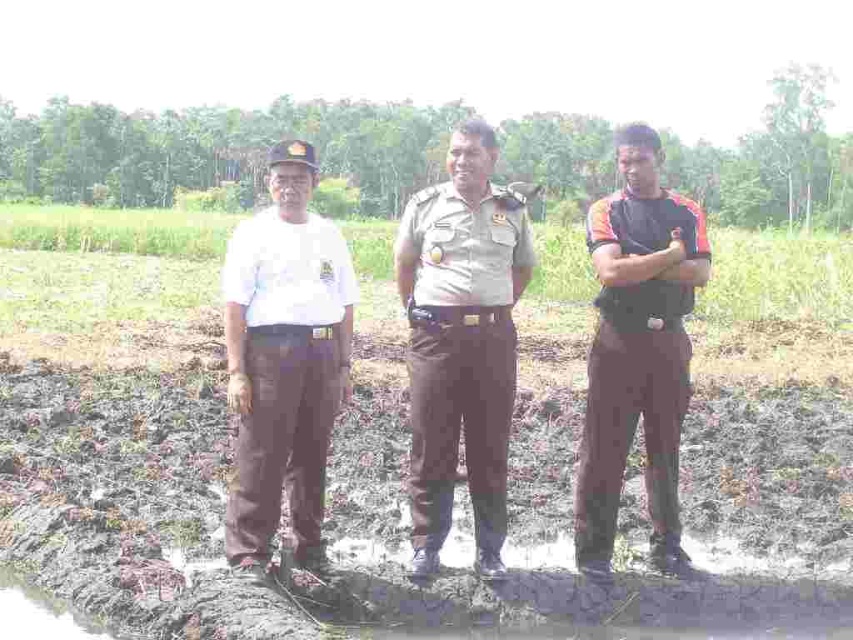
You are a photographer trying to capture a group photo of the white matte shirt at center and the dark brown uniform at center. Since you want to ensure both are clearly visible, which person should you position closer to the camera to avoid being overshadowed?

The white matte shirt at center should be positioned closer to the camera because it occupies less space than the dark brown uniform at center, making it easier to ensure both are clearly visible.

You are standing at the origin of a coordinate system placed at the bottom left corner of the image. A point is marked at coordinates [461,342]. Which object does this point correspond to?

The point at coordinates [461,342] corresponds to the light brown uniform at center.

You are a photographer standing at the edge of the field. You want to take a group photo of the light brown uniform at center and the white matte shirt at center. If your camera has a maximum focus range of 40 inches, will both subjects be in focus?

The distance between the light brown uniform at center and the white matte shirt at center is 39.29 inches, which is within the camera maximum focus range of 40 inches. Therefore, both subjects will be in focus.